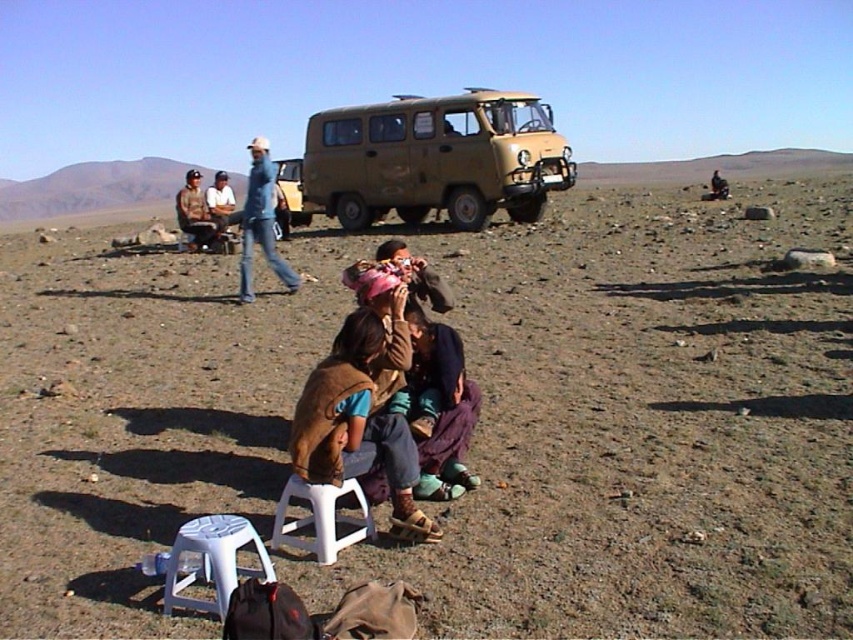
Question: Among these points, which one is nearest to the camera?

Choices:
 (A) (242, 541)
 (B) (354, 493)
 (C) (271, 212)
 (D) (233, 268)

Answer: (A)

Question: Can you confirm if brown dirt field at center is smaller than white plastic stool at center?

Choices:
 (A) yes
 (B) no

Answer: (B)

Question: Based on their relative distances, which object is farther from the brown leather jacket at center?

Choices:
 (A) camouflage fabric van at center
 (B) white plastic stool at lower center
 (C) brown dirt field at center
 (D) jeans at center

Answer: (B)

Question: Is white plastic stool at lower center smaller than white plastic stool at center?

Choices:
 (A) no
 (B) yes

Answer: (B)

Question: Can you confirm if brown dirt field at center is thinner than light brown leather jacket at center?

Choices:
 (A) no
 (B) yes

Answer: (A)

Question: Estimate the real-world distances between objects in this image. Which object is closer to the brown dirt field at center?

Choices:
 (A) white plastic stool at lower center
 (B) camouflage fabric van at center
 (C) white plastic stool at center
 (D) brown leather jacket at center

Answer: (C)